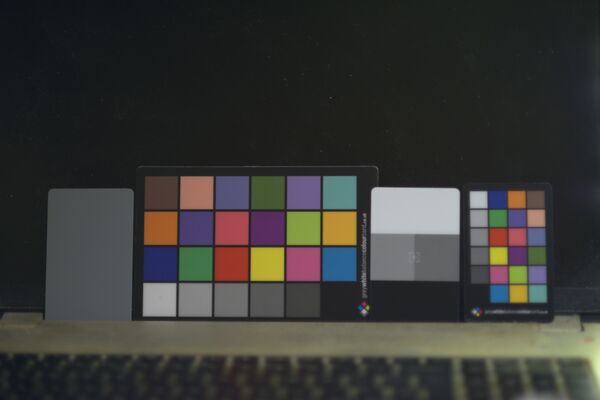
At what (x,y) coordinates should I click in order to perform the action: click on table. Please return your answer as a coordinate pair (x, y). Looking at the image, I should click on (332, 331).